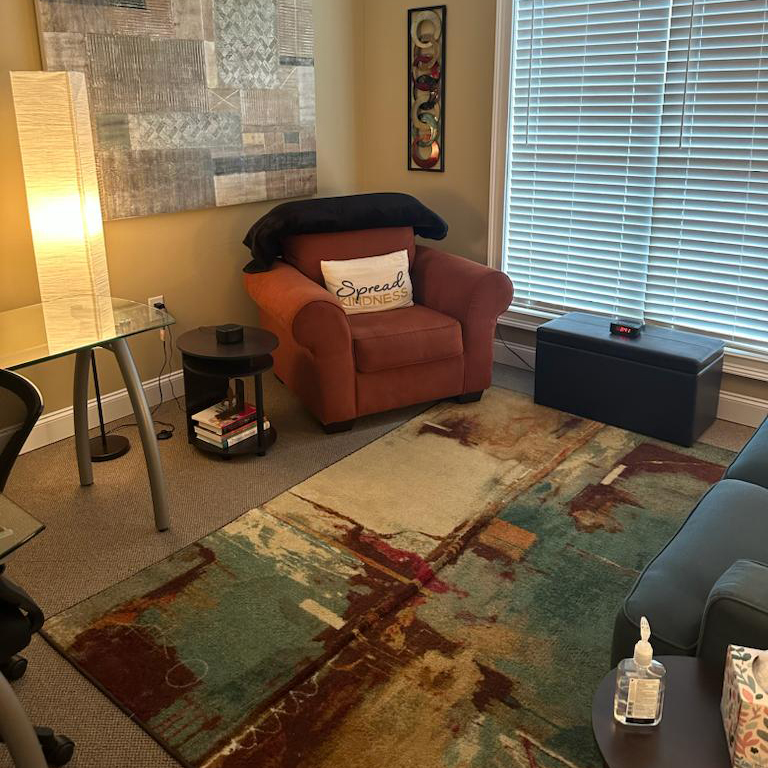
You are a GUI agent. You are given a task and a screenshot of the screen. Output one action in this format:
    pyautogui.click(x=<x>, y=<y>)
    Task: Click on the ottoman
    The height and width of the screenshot is (768, 768).
    Given the screenshot: What is the action you would take?
    pyautogui.click(x=646, y=408)